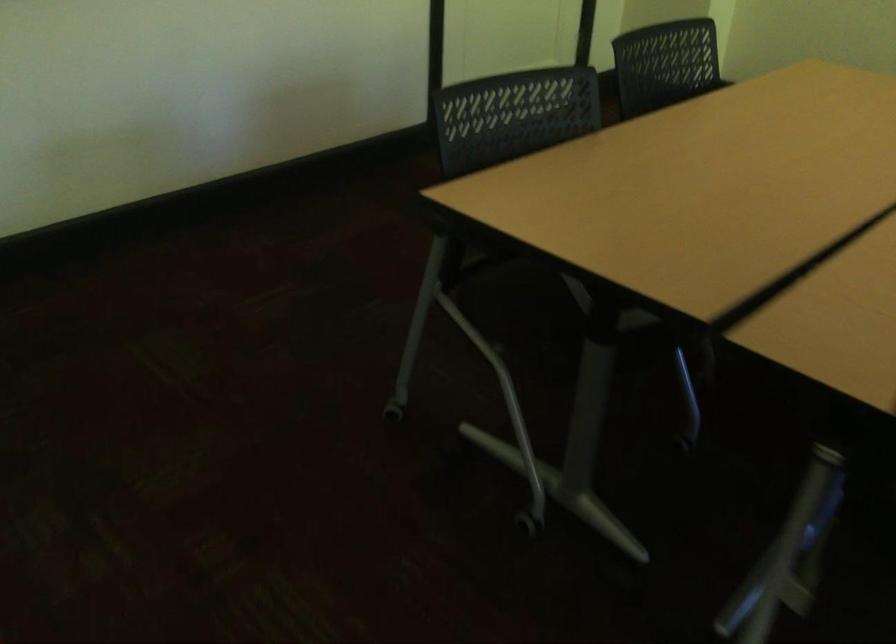
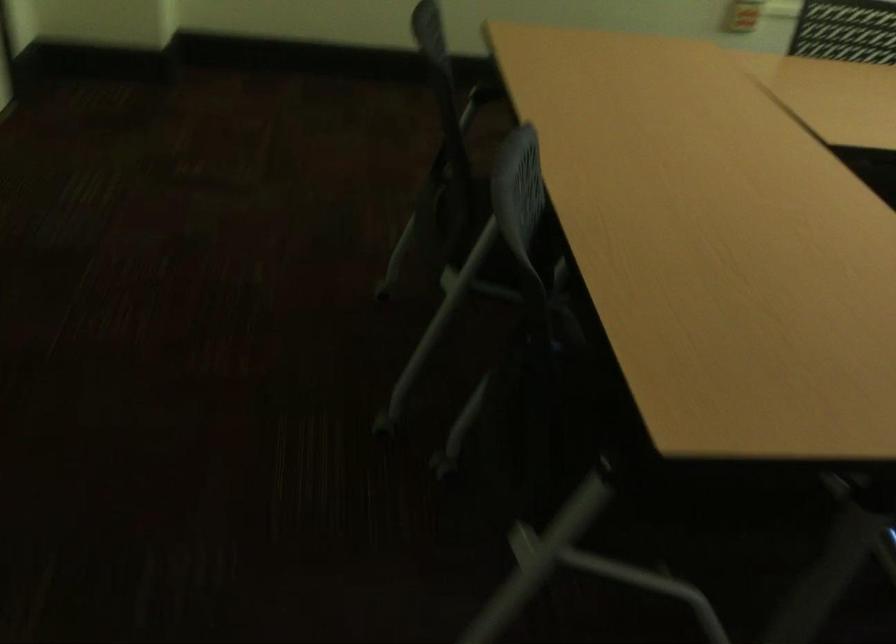
Find the pixel in the second image that matches (452,80) in the first image.

(501, 214)